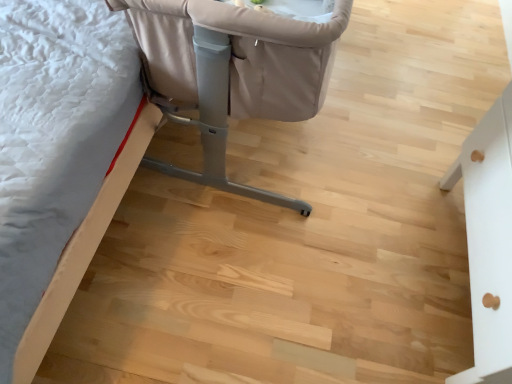
I want to click on vacant space underneath white matte drawer at right, which appears as the third furniture when viewed from the left (from a real-world perspective), so click(451, 273).